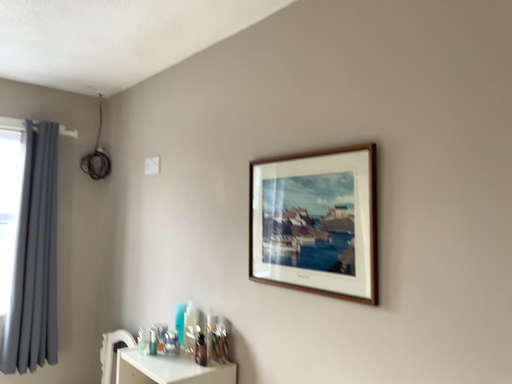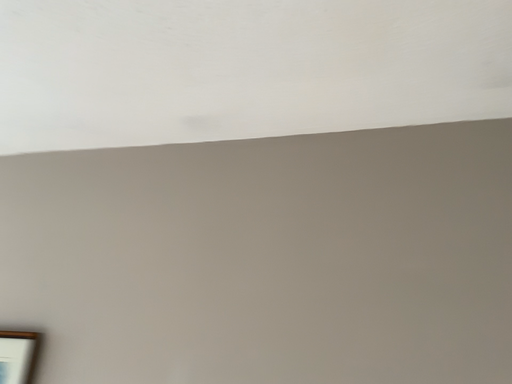
Question: How did the camera likely rotate when shooting the video?

Choices:
 (A) rotated upward
 (B) rotated downward

Answer: (A)